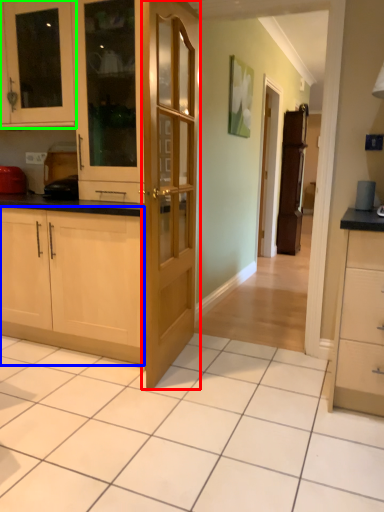
Question: Which is farther away from door (highlighted by a red box)? cabinetry (highlighted by a blue box) or cabinetry (highlighted by a green box)?

Choices:
 (A) cabinetry
 (B) cabinetry

Answer: (B)